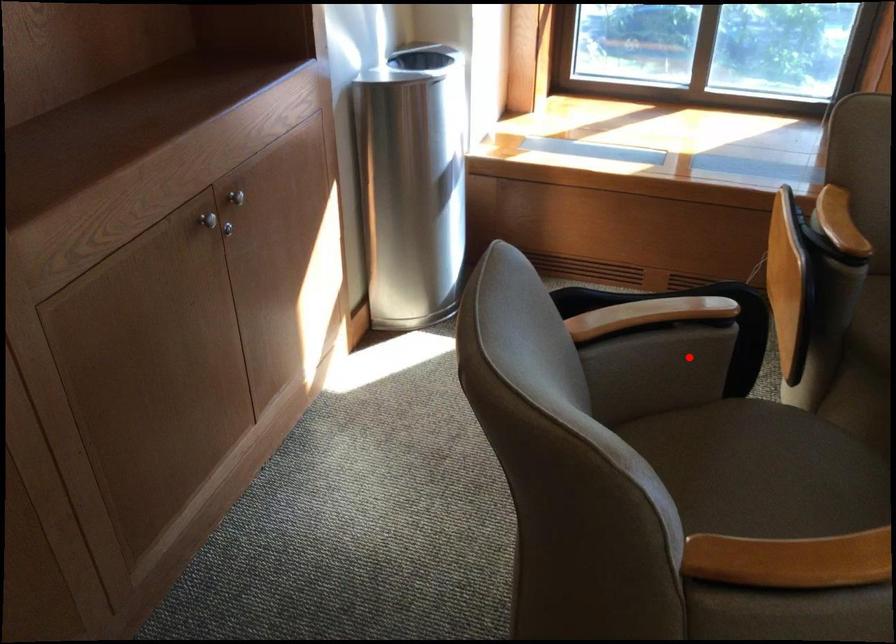
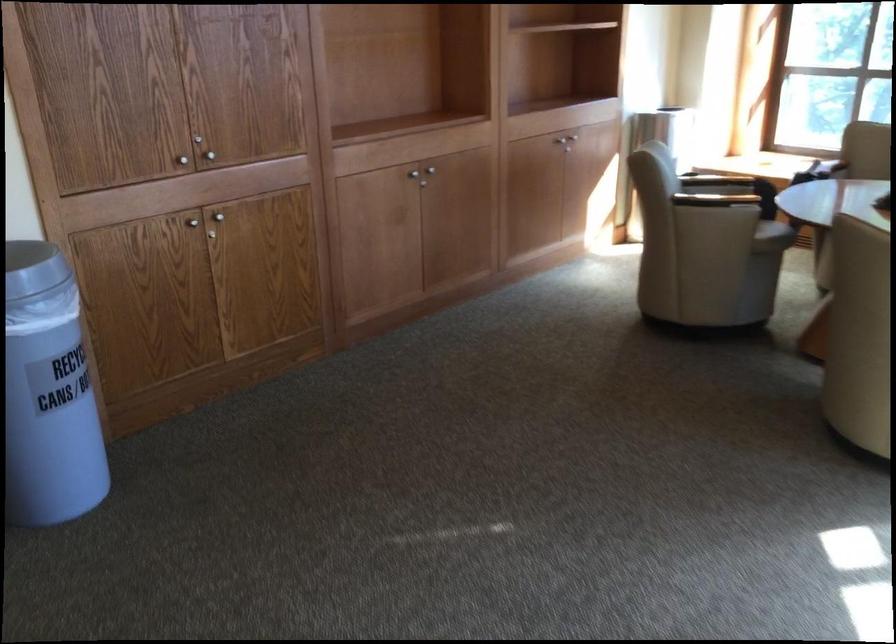
In the second image, find the point that corresponds to the highlighted location in the first image.

(731, 178)